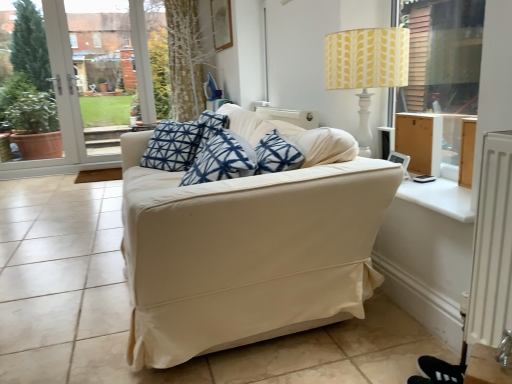
Question: Is beige fabric couch at center wider or thinner than white smooth window sill at right?

Choices:
 (A) wide
 (B) thin

Answer: (A)

Question: In terms of height, does beige fabric couch at center look taller or shorter compared to white smooth window sill at right?

Choices:
 (A) tall
 (B) short

Answer: (A)

Question: Estimate the real-world distances between objects in this image. Which object is farther from the beige fabric couch at center?

Choices:
 (A) yellow fabric lampshade at upper right
 (B) white smooth window sill at right
 (C) white glass door at left

Answer: (C)

Question: Estimate the real-world distances between objects in this image. Which object is closer to the white glass door at left?

Choices:
 (A) beige fabric couch at center
 (B) white smooth window sill at right
 (C) yellow fabric lampshade at upper right

Answer: (C)